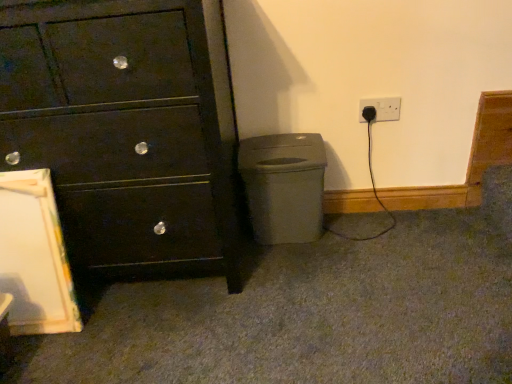
Question: Does black plastic plug at lower right have a larger size compared to matte gray plastic at lower right?

Choices:
 (A) no
 (B) yes

Answer: (A)

Question: Does black plastic plug at lower right have a greater width compared to matte gray plastic at lower right?

Choices:
 (A) yes
 (B) no

Answer: (B)

Question: Would you say matte gray plastic at lower right is part of black plastic plug at lower right's contents?

Choices:
 (A) yes
 (B) no

Answer: (B)

Question: Is the depth of black plastic plug at lower right less than that of matte gray plastic at lower right?

Choices:
 (A) yes
 (B) no

Answer: (B)

Question: Can you confirm if black plastic plug at lower right is thinner than matte gray plastic at lower right?

Choices:
 (A) no
 (B) yes

Answer: (B)

Question: In terms of width, does matte gray plastic at lower right look wider or thinner when compared to black plastic plug at lower right?

Choices:
 (A) wide
 (B) thin

Answer: (A)

Question: From the image's perspective, is matte gray plastic at lower right positioned above or below black plastic plug at lower right?

Choices:
 (A) below
 (B) above

Answer: (A)

Question: Visually, is matte gray plastic at lower right positioned to the left or to the right of black plastic plug at lower right?

Choices:
 (A) left
 (B) right

Answer: (A)

Question: Relative to black plastic plug at lower right, is matte gray plastic at lower right in front or behind?

Choices:
 (A) front
 (B) behind

Answer: (A)

Question: From a real-world perspective, is black plastic plug at lower right physically located above or below matte gray plastic at lower right?

Choices:
 (A) below
 (B) above

Answer: (B)

Question: In terms of height, does black plastic plug at lower right look taller or shorter compared to matte gray plastic at lower right?

Choices:
 (A) short
 (B) tall

Answer: (A)

Question: From the image's perspective, is black plastic plug at lower right above or below matte gray plastic at lower right?

Choices:
 (A) below
 (B) above

Answer: (B)

Question: Does point (394, 114) appear closer or farther from the camera than point (284, 223)?

Choices:
 (A) farther
 (B) closer

Answer: (A)

Question: Considering the positions of black plastic plug at lower right and matte black chest of drawers at left in the image, is black plastic plug at lower right bigger or smaller than matte black chest of drawers at left?

Choices:
 (A) small
 (B) big

Answer: (A)

Question: In the image, is black plastic plug at lower right on the left side or the right side of matte black chest of drawers at left?

Choices:
 (A) right
 (B) left

Answer: (A)